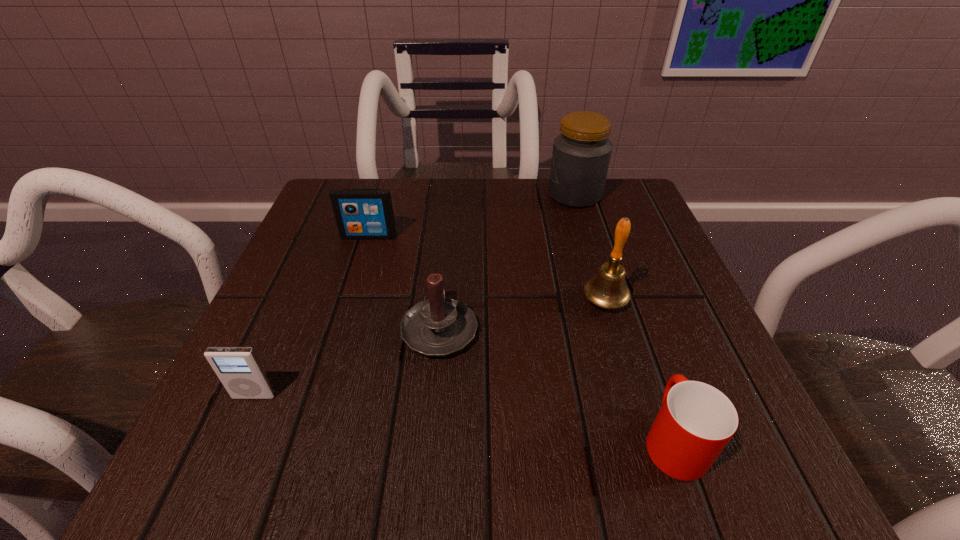
Where is `the farthest object`? This screenshot has width=960, height=540. the farthest object is located at coordinates (581, 155).

The height and width of the screenshot is (540, 960). Identify the location of bell. (608, 290).

Locate an element on the screen. the fourth object from right to left is located at coordinates (437, 327).

Find the location of a particular element. Image resolution: width=960 pixels, height=540 pixels. the right iPod is located at coordinates (359, 213).

Locate an element on the screen. Image resolution: width=960 pixels, height=540 pixels. the farther iPod is located at coordinates (359, 213).

Find the location of a particular element. the fifth farthest object is located at coordinates pos(240,371).

What are the coordinates of `the leftmost object` in the screenshot? It's located at (240, 371).

Where is `the nearest object`? This screenshot has height=540, width=960. the nearest object is located at coordinates point(696,421).

At what (x,y) coordinates should I click in order to perform the action: click on vacant space situated 0.380m on the surface of the jar near the warning symbol. Please return your answer as a coordinate pair (x, y). Image resolution: width=960 pixels, height=540 pixels. Looking at the image, I should click on (384, 194).

Identify the location of vacant area situated 0.280m on the surface of the jar near the warning symbol. (427, 194).